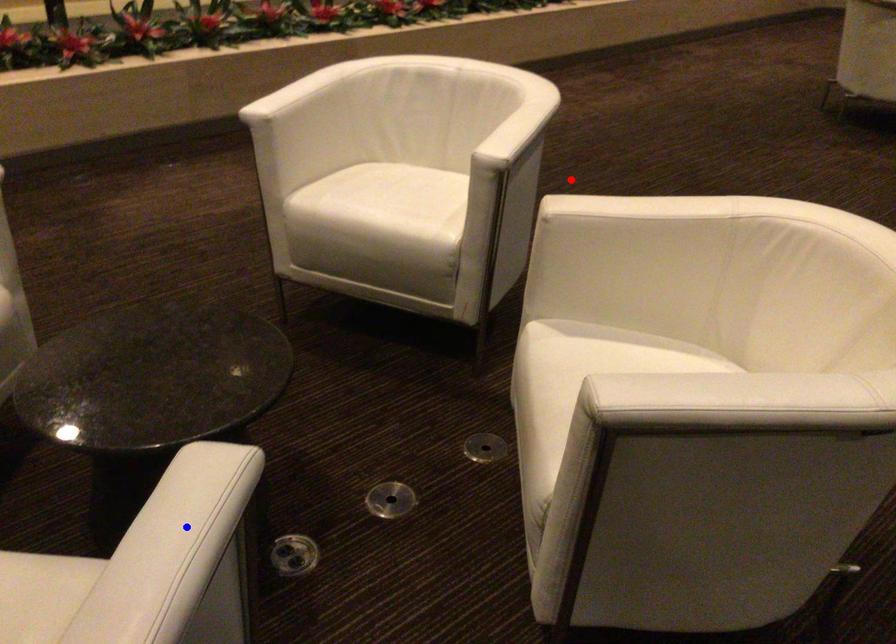
Question: Two points are marked on the image. Which point is closer to the camera?

Choices:
 (A) Blue point is closer.
 (B) Red point is closer.

Answer: (A)